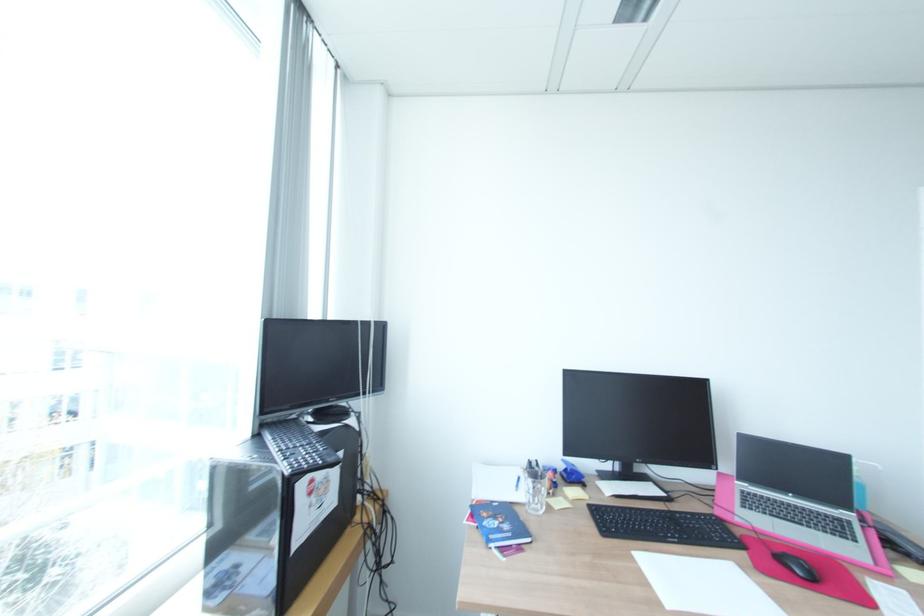
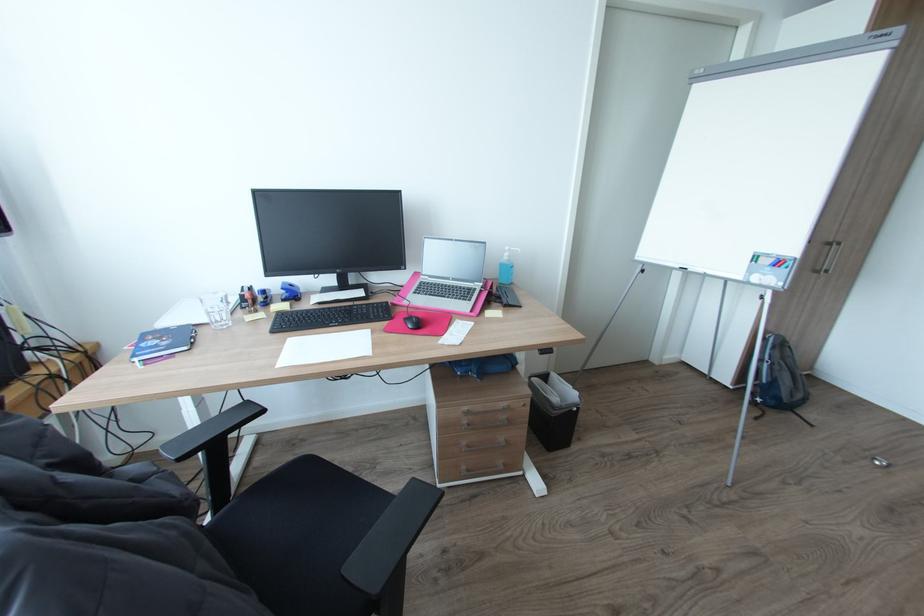
First-person continuous shooting, in which direction is the camera rotating?

The camera's rotation is toward right-down.